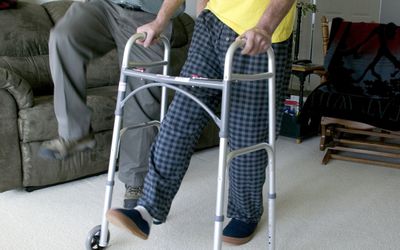
Identify the location of sofa. Image resolution: width=400 pixels, height=250 pixels. (28, 71).